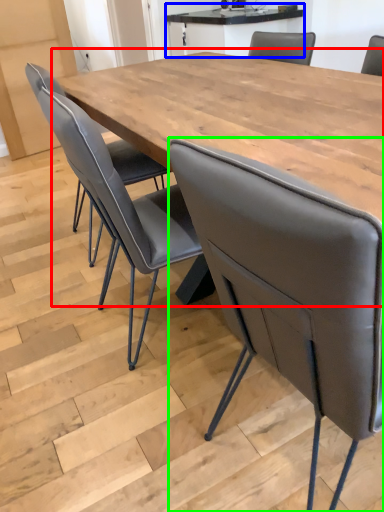
Question: Which is nearer to the table (highlighted by a red box)? table (highlighted by a blue box) or chair (highlighted by a green box).

Choices:
 (A) table
 (B) chair

Answer: (B)